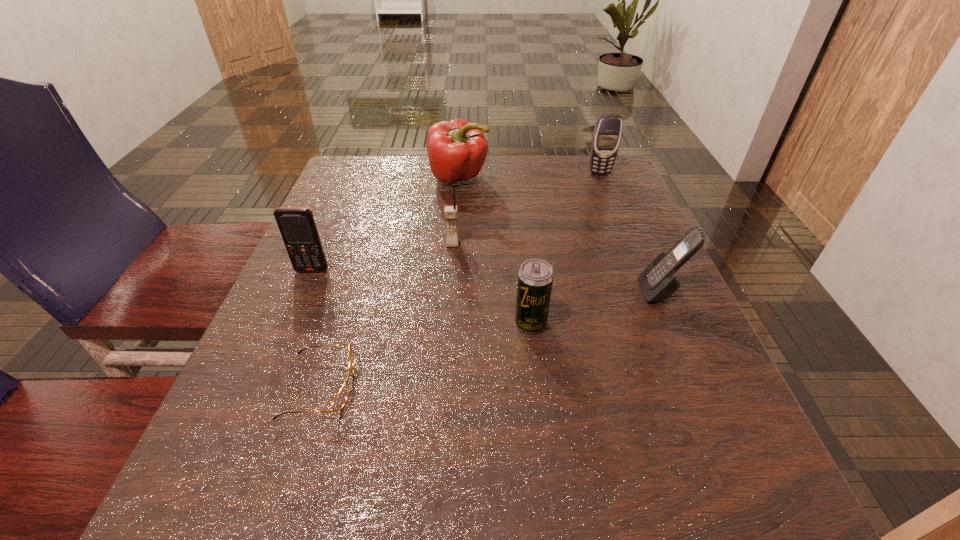
Where is `cellular telephone located in the far edge section of the desktop`? Image resolution: width=960 pixels, height=540 pixels. cellular telephone located in the far edge section of the desktop is located at coordinates (607, 133).

You are a GUI agent. You are given a task and a screenshot of the screen. Output one action in this format:
    pyautogui.click(x=<x>, y=<y>)
    Task: Click on the bell pepper positioned at the far edge
    Image resolution: width=960 pixels, height=540 pixels.
    Given the screenshot: What is the action you would take?
    pyautogui.click(x=457, y=149)

Find the location of `cellular telephone that is at the left edge`. cellular telephone that is at the left edge is located at coordinates (297, 226).

Locate an element on the screen. spectacles present at the left edge is located at coordinates (340, 399).

This screenshot has width=960, height=540. I want to click on object that is positioned at the far right corner, so click(607, 133).

In the image, there is a desktop. Where is `vacant region at the far edge`? This screenshot has height=540, width=960. vacant region at the far edge is located at coordinates [556, 178].

In the image, there is a desktop. In order to click on free space at the near edge in this screenshot , I will do `click(556, 536)`.

Where is `free region at the left edge`? free region at the left edge is located at coordinates (380, 217).

This screenshot has width=960, height=540. I want to click on vacant area at the right edge, so click(704, 438).

Identify the location of vacant space at the near left corner of the desktop. The width and height of the screenshot is (960, 540). (298, 528).